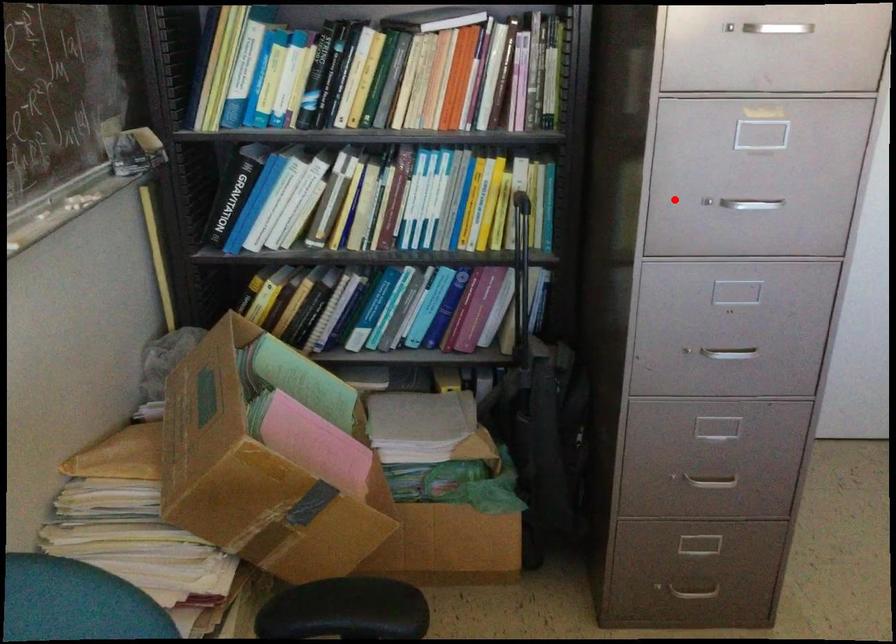
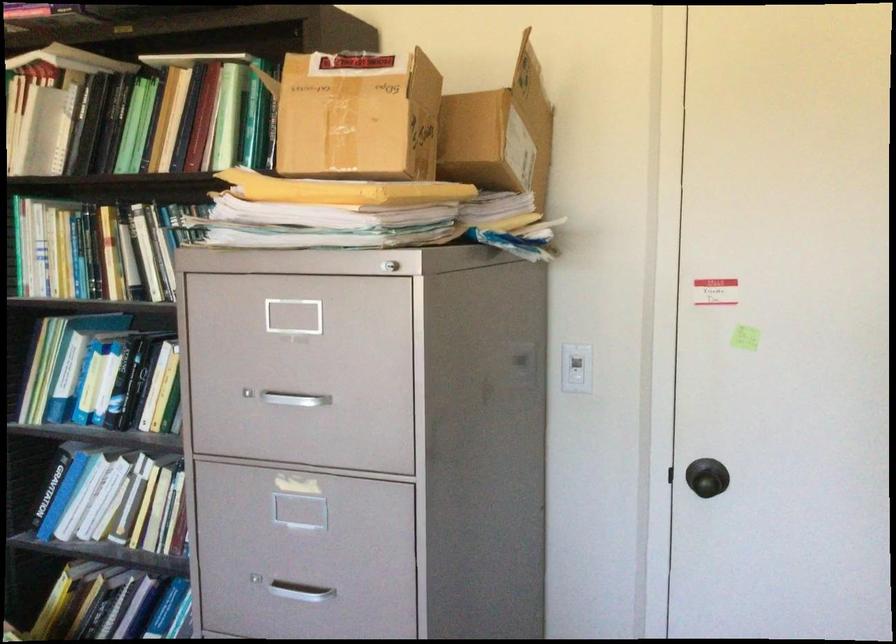
Question: I am providing you with two images of the same scene from different viewpoints. A red point is shown in image1. For the corresponding object point in image2, is it positioned nearer or farther from the camera?

Choices:
 (A) Nearer
 (B) Farther

Answer: (A)